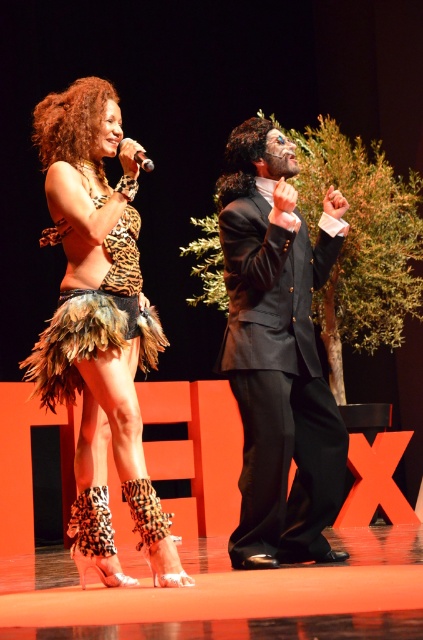
Question: Does leopard print feather skirt at center come behind leopard print fabric skirt at left?

Choices:
 (A) no
 (B) yes

Answer: (A)

Question: Which object is positioned farthest from the metallic silver microphone at upper left?

Choices:
 (A) leopard print fabric skirt at left
 (B) shiny black suit at center
 (C) leopard print feather skirt at center

Answer: (B)

Question: Can you confirm if shiny black suit at center is thinner than metallic silver microphone at upper left?

Choices:
 (A) yes
 (B) no

Answer: (B)

Question: Based on their relative distances, which object is farther from the metallic silver microphone at upper left?

Choices:
 (A) leopard print feather skirt at center
 (B) leopard print fabric skirt at left

Answer: (A)

Question: In this image, where is shiny black suit at center located relative to metallic silver microphone at upper left?

Choices:
 (A) above
 (B) below

Answer: (B)

Question: Which object is positioned closest to the leopard print fabric skirt at left?

Choices:
 (A) leopard print feather skirt at center
 (B) metallic silver microphone at upper left
 (C) shiny black suit at center

Answer: (A)